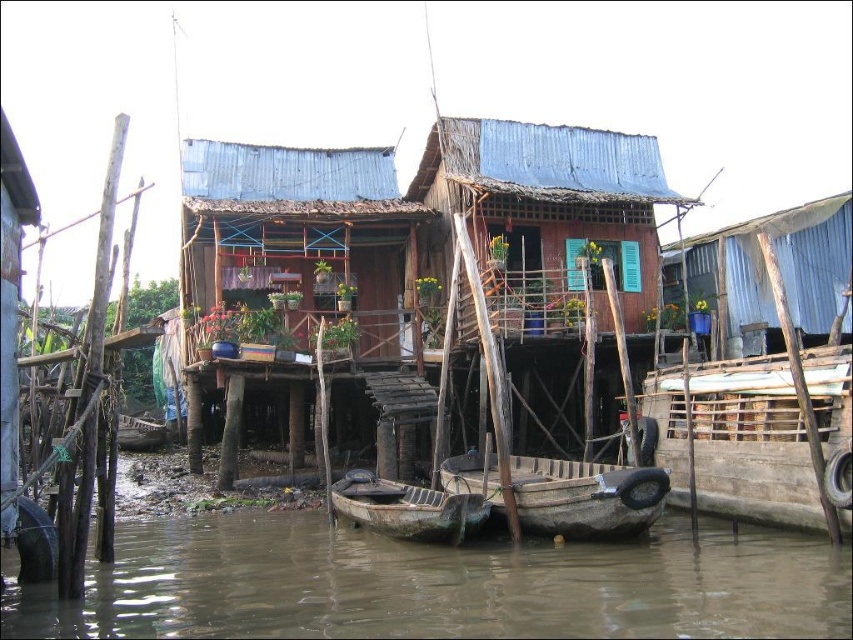
You are planning to transport a large wooden crate that is 3 meters long. You see a wooden planks boat at right and a blue corrugated metal hut at upper right. Which object can accommodate the crate based on their sizes?

The blue corrugated metal hut at upper right can accommodate the large wooden crate since it is larger than the wooden planks boat at right.

You are a visitor who wants to board a boat. You see the wooden planks boat at right and the rusty metal boat at center. Which boat is taller and can you board it?

The wooden planks boat at right is taller than the rusty metal boat at center. You can board the wooden planks boat at right.

You are standing on the wooden hut at center and want to look down at the brown muddy water at lower center. Which direction should you look to see it?

The brown muddy water at lower center is closer to the viewer than the wooden hut at center, so you should look downward to see it.